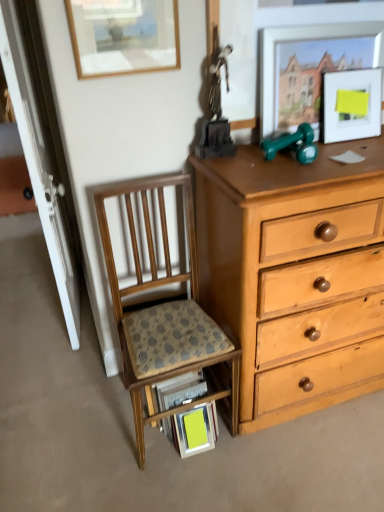
Identify the location of green rubber dumbbells at upper right. (292, 144).

Locate an element on the screen. matte silver picture frame at upper right, the second picture frame in the right-to-left sequence is located at coordinates (304, 39).

What is the approximate width of matte silver picture frame at upper right, the second picture frame in the right-to-left sequence?

It is 6.50 centimeters.

Describe the element at coordinates (162, 310) in the screenshot. This screenshot has height=512, width=384. I see `wooden chair with patterned cushion at lower left` at that location.

How much space does wooden picture frame at upper left, the 1th picture frame in the left-to-right sequence, occupy horizontally?

The width of wooden picture frame at upper left, the 1th picture frame in the left-to-right sequence, is 1.18 inches.

You are a GUI agent. You are given a task and a screenshot of the screen. Output one action in this format:
    pyautogui.click(x=<x>, y=<y>)
    Task: Click on the wooden desk at lower center
    Image resolution: width=384 pixels, height=512 pixels.
    Given the screenshot: What is the action you would take?
    pyautogui.click(x=192, y=400)

Does matte white picture frame at upper right, the first picture frame from the right, have a smaller size compared to wooden chair with patterned cushion at lower left?

Correct, matte white picture frame at upper right, the first picture frame from the right, occupies less space than wooden chair with patterned cushion at lower left.

Would you say matte white picture frame at upper right, which ranks as the 3th picture frame in left-to-right order, is inside or outside wooden chair with patterned cushion at lower left?

matte white picture frame at upper right, which ranks as the 3th picture frame in left-to-right order, is outside wooden chair with patterned cushion at lower left.

Measure the distance from matte white picture frame at upper right, the first picture frame from the right, to wooden chair with patterned cushion at lower left.

matte white picture frame at upper right, the first picture frame from the right, and wooden chair with patterned cushion at lower left are 30.38 inches apart from each other.

Considering the points (347, 130) and (221, 337), which point is in front, point (347, 130) or point (221, 337)?

The point (221, 337) is in front.

Is the depth of wooden desk at lower center greater than that of matte silver picture frame at upper right, which ranks as the 2th picture frame in left-to-right order?

Yes, wooden desk at lower center is further from the camera.

Is point (142, 438) closer or farther from the camera than point (261, 135)?

Point (142, 438) is farther from the camera than point (261, 135).

Are wooden desk at lower center and matte silver picture frame at upper right, the second picture frame in the right-to-left sequence, beside each other?

No, wooden desk at lower center is not next to matte silver picture frame at upper right, the second picture frame in the right-to-left sequence.

Is wooden desk at lower center facing away from matte silver picture frame at upper right, which ranks as the 2th picture frame in left-to-right order?

wooden desk at lower center does not have its back to matte silver picture frame at upper right, which ranks as the 2th picture frame in left-to-right order.

From the image's perspective, is wooden picture frame at upper left, positioned as the 3th picture frame in right-to-left order, located above or below wooden desk at lower center?

Clearly, from the image's perspective, wooden picture frame at upper left, positioned as the 3th picture frame in right-to-left order, is above wooden desk at lower center.

How far apart are wooden picture frame at upper left, the 1th picture frame in the left-to-right sequence, and wooden desk at lower center?

wooden picture frame at upper left, the 1th picture frame in the left-to-right sequence, and wooden desk at lower center are 1.07 meters apart from each other.

The height and width of the screenshot is (512, 384). Identify the location of desk lying below the wooden picture frame at upper left, the 1th picture frame in the left-to-right sequence (from the image's perspective). (192, 400).

Is wooden picture frame at upper left, the 1th picture frame in the left-to-right sequence, spatially inside wooden desk at lower center, or outside of it?

wooden picture frame at upper left, the 1th picture frame in the left-to-right sequence, exists outside the volume of wooden desk at lower center.

From their relative heights in the image, would you say matte silver picture frame at upper right, the second picture frame in the right-to-left sequence, is taller or shorter than green rubber dumbbells at upper right?

Considering their sizes, matte silver picture frame at upper right, the second picture frame in the right-to-left sequence, has more height than green rubber dumbbells at upper right.

The image size is (384, 512). Identify the location of toy below the matte silver picture frame at upper right, the second picture frame in the right-to-left sequence (from the image's perspective). (292, 144).

How distant is matte silver picture frame at upper right, which ranks as the 2th picture frame in left-to-right order, from green rubber dumbbells at upper right?

The distance of matte silver picture frame at upper right, which ranks as the 2th picture frame in left-to-right order, from green rubber dumbbells at upper right is 7.46 inches.

From the image's perspective, is matte silver picture frame at upper right, the second picture frame in the right-to-left sequence, positioned above or below green rubber dumbbells at upper right?

Clearly, from the image's perspective, matte silver picture frame at upper right, the second picture frame in the right-to-left sequence, is above green rubber dumbbells at upper right.

At what (x,y) coordinates should I click in order to perform the action: click on desk in front of the matte white picture frame at upper right, which ranks as the 3th picture frame in left-to-right order. Please return your answer as a coordinate pair (x, y). The image size is (384, 512). Looking at the image, I should click on (192, 400).

Is wooden desk at lower center wider or thinner than matte white picture frame at upper right, which ranks as the 3th picture frame in left-to-right order?

In the image, wooden desk at lower center appears to be wider than matte white picture frame at upper right, which ranks as the 3th picture frame in left-to-right order.

Does point (221, 383) come in front of point (328, 74)?

No, it is not.

Is wooden desk at lower center taller than matte white picture frame at upper right, the first picture frame from the right?

Yes, wooden desk at lower center is taller than matte white picture frame at upper right, the first picture frame from the right.

Does point (94, 47) come behind point (287, 147)?

No, (94, 47) is closer to viewer.

Is wooden picture frame at upper left, positioned as the 3th picture frame in right-to-left order, positioned beyond the bounds of green rubber dumbbells at upper right?

wooden picture frame at upper left, positioned as the 3th picture frame in right-to-left order, is positioned outside green rubber dumbbells at upper right.

Considering the relative sizes of wooden picture frame at upper left, the 1th picture frame in the left-to-right sequence, and green rubber dumbbells at upper right in the image provided, is wooden picture frame at upper left, the 1th picture frame in the left-to-right sequence, smaller than green rubber dumbbells at upper right?

No, wooden picture frame at upper left, the 1th picture frame in the left-to-right sequence, is not smaller than green rubber dumbbells at upper right.

From the image's perspective, between wooden picture frame at upper left, positioned as the 3th picture frame in right-to-left order, and green rubber dumbbells at upper right, which one is located above?

wooden picture frame at upper left, positioned as the 3th picture frame in right-to-left order, from the image's perspective.

Is matte white picture frame at upper right, the first picture frame from the right, at the back of wooden chair with patterned cushion at lower left?

That's not correct — wooden chair with patterned cushion at lower left is not looking away from matte white picture frame at upper right, the first picture frame from the right.

How much distance is there between wooden chair with patterned cushion at lower left and matte white picture frame at upper right, which ranks as the 3th picture frame in left-to-right order?

A distance of 30.38 inches exists between wooden chair with patterned cushion at lower left and matte white picture frame at upper right, which ranks as the 3th picture frame in left-to-right order.

Can you confirm if wooden chair with patterned cushion at lower left is wider than matte white picture frame at upper right, which ranks as the 3th picture frame in left-to-right order?

Correct, the width of wooden chair with patterned cushion at lower left exceeds that of matte white picture frame at upper right, which ranks as the 3th picture frame in left-to-right order.

Where is `the 1st picture frame above the wooden chair with patterned cushion at lower left (from the image's perspective)`? This screenshot has height=512, width=384. the 1st picture frame above the wooden chair with patterned cushion at lower left (from the image's perspective) is located at coordinates (350, 105).

Where is `picture frame that is the 2nd object to the right of the wooden chair with patterned cushion at lower left, starting at the anchor`? The width and height of the screenshot is (384, 512). picture frame that is the 2nd object to the right of the wooden chair with patterned cushion at lower left, starting at the anchor is located at coordinates (350, 105).

Where is `desk lying below the matte silver picture frame at upper right, the second picture frame in the right-to-left sequence (from the image's perspective)`? This screenshot has width=384, height=512. desk lying below the matte silver picture frame at upper right, the second picture frame in the right-to-left sequence (from the image's perspective) is located at coordinates (192, 400).

Considering their positions, is green rubber dumbbells at upper right positioned closer to wooden chair with patterned cushion at lower left than wooden picture frame at upper left, positioned as the 3th picture frame in right-to-left order?

The object closer to wooden chair with patterned cushion at lower left is green rubber dumbbells at upper right.

Considering their positions, is wooden picture frame at upper left, positioned as the 3th picture frame in right-to-left order, positioned further to green rubber dumbbells at upper right than matte silver picture frame at upper right, the second picture frame in the right-to-left sequence?

wooden picture frame at upper left, positioned as the 3th picture frame in right-to-left order, is further to green rubber dumbbells at upper right.

From the image, which object appears to be farther from wooden chair with patterned cushion at lower left, matte silver picture frame at upper right, the second picture frame in the right-to-left sequence, or green rubber dumbbells at upper right?

matte silver picture frame at upper right, the second picture frame in the right-to-left sequence, lies further to wooden chair with patterned cushion at lower left than the other object.

Based on their spatial positions, is matte silver picture frame at upper right, which ranks as the 2th picture frame in left-to-right order, or wooden chair with patterned cushion at lower left closer to matte white picture frame at upper right, the first picture frame from the right?

Among the two, matte silver picture frame at upper right, which ranks as the 2th picture frame in left-to-right order, is located nearer to matte white picture frame at upper right, the first picture frame from the right.

Which object lies further to the anchor point wooden desk at lower center, matte silver picture frame at upper right, which ranks as the 2th picture frame in left-to-right order, or wooden picture frame at upper left, the 1th picture frame in the left-to-right sequence?

wooden picture frame at upper left, the 1th picture frame in the left-to-right sequence, is further to wooden desk at lower center.

Which object lies further to the anchor point wooden desk at lower center, wooden chair with patterned cushion at lower left or matte white picture frame at upper right, the first picture frame from the right?

matte white picture frame at upper right, the first picture frame from the right.

When comparing their distances from wooden chair with patterned cushion at lower left, does green rubber dumbbells at upper right or matte silver picture frame at upper right, which ranks as the 2th picture frame in left-to-right order, seem closer?

green rubber dumbbells at upper right is closer to wooden chair with patterned cushion at lower left.

Which object lies nearer to the anchor point wooden desk at lower center, matte white picture frame at upper right, the first picture frame from the right, or green rubber dumbbells at upper right?

Among the two, green rubber dumbbells at upper right is located nearer to wooden desk at lower center.

Where is `chair between matte silver picture frame at upper right, which ranks as the 2th picture frame in left-to-right order, and wooden desk at lower center, in the vertical direction`? The width and height of the screenshot is (384, 512). chair between matte silver picture frame at upper right, which ranks as the 2th picture frame in left-to-right order, and wooden desk at lower center, in the vertical direction is located at coordinates (162, 310).

Identify the location of toy between wooden picture frame at upper left, the 1th picture frame in the left-to-right sequence, and matte silver picture frame at upper right, the second picture frame in the right-to-left sequence, from left to right. The width and height of the screenshot is (384, 512). (292, 144).

At what (x,y) coordinates should I click in order to perform the action: click on toy between wooden picture frame at upper left, the 1th picture frame in the left-to-right sequence, and wooden desk at lower center, in the vertical direction. Please return your answer as a coordinate pair (x, y). This screenshot has width=384, height=512. Looking at the image, I should click on (292, 144).

The width and height of the screenshot is (384, 512). In order to click on toy that lies between matte silver picture frame at upper right, the second picture frame in the right-to-left sequence, and wooden desk at lower center from top to bottom in this screenshot , I will do `click(292, 144)`.